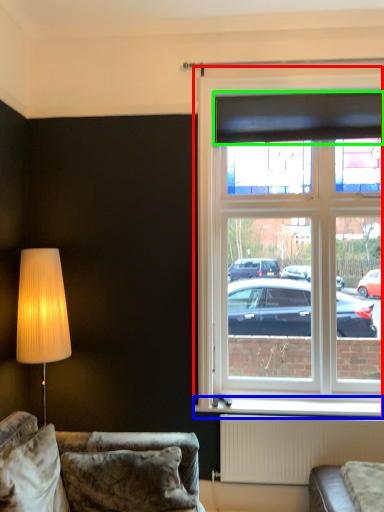
Question: Which is nearer to the window (highlighted by a red box)? window sill (highlighted by a blue box) or curtain (highlighted by a green box).

Choices:
 (A) window sill
 (B) curtain

Answer: (B)